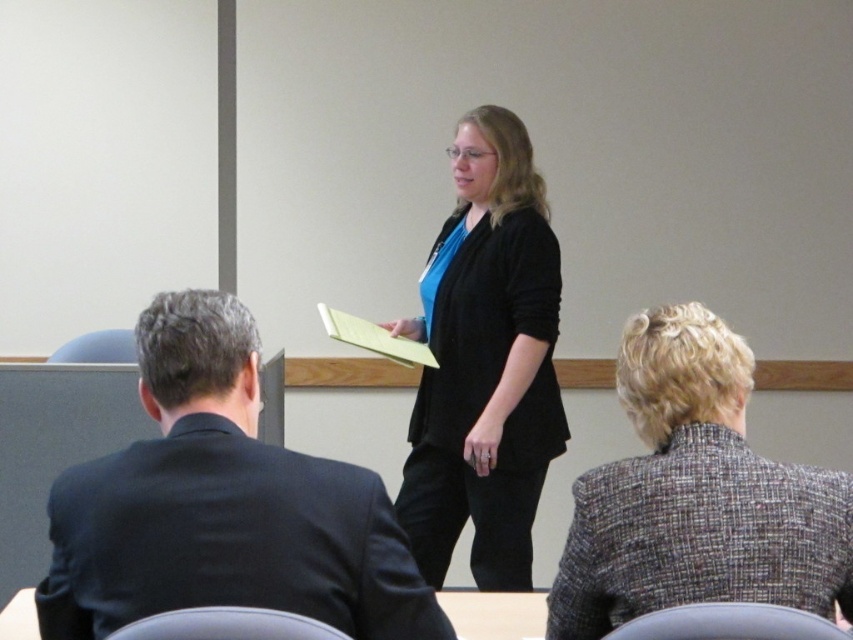
You are a photographer in the back of the room. You need to take a photo of the dark blue suit at left and the matte black blazer at center. Which one will appear larger in your photo?

The dark blue suit at left will appear larger in the photo because it is closer to the viewer than the matte black blazer at center.

You are organizing a small event and need to seat attendees in a row. You have two guests wearing the dark blue suit at left and gray tweed blazer at lower right. The seating area allows for a maximum distance of 20 inches between adjacent seats. Can these two guests be seated next to each other without violating the seating arrangement rules?

The distance between the dark blue suit at left and gray tweed blazer at lower right is 20.46 inches. Since the maximum allowed distance between seats is 20 inches, seating them next to each other would exceed the limit. Therefore, they cannot be seated adjacent to each other.

You are organizing a meeting and need to place a 3.5 feet wide table between the gray tweed blazer at lower right and the matte black blazer at center. Will the table fit in the space between them?

The distance between the gray tweed blazer at lower right and the matte black blazer at center is 3.68 feet, so a 3.5 feet wide table will fit as it is slightly narrower than the available space.